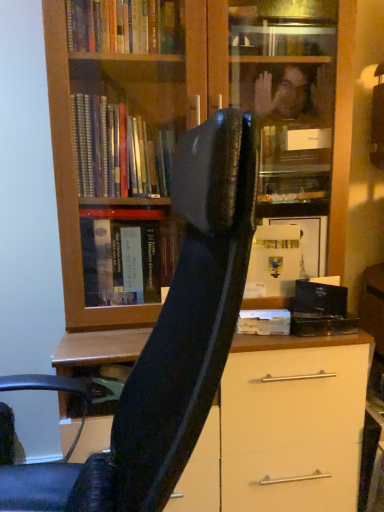
Question: From a real-world perspective, is wooden bookcase at center physically located above or below black leather chair at center?

Choices:
 (A) above
 (B) below

Answer: (A)

Question: In the image, is wooden bookcase at center on the left side or the right side of black leather chair at center?

Choices:
 (A) left
 (B) right

Answer: (B)

Question: Which object is positioned closest to the white matte paper at center?

Choices:
 (A) black leather chair at center
 (B) wooden bookcase at center

Answer: (A)

Question: Considering the real-world distances, which object is farthest from the white matte paper at center?

Choices:
 (A) wooden bookcase at center
 (B) black leather chair at center

Answer: (A)